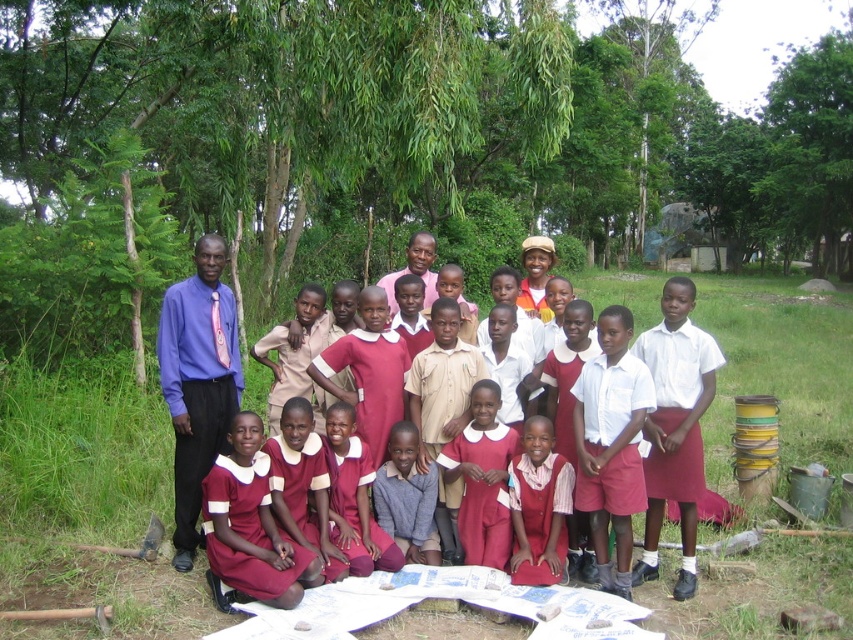
Between maroon dress at center and pink fabric shirt at center, which one has less height?

With less height is maroon dress at center.

Between maroon dress at center and pink fabric shirt at center, which one is positioned lower?

Positioned lower is maroon dress at center.

Is point (273, 406) behind point (412, 273)?

No, it is in front of (412, 273).

Locate an element on the screen. maroon dress at center is located at coordinates (334, 340).

Does point (641, 342) come behind point (177, 305)?

No, it is in front of (177, 305).

Is maroon dress at center taller than purple smooth shirt at center?

In fact, maroon dress at center may be shorter than purple smooth shirt at center.

Find the location of a particular element. maroon dress at center is located at coordinates (334, 340).

Where is `maroon dress at center`? maroon dress at center is located at coordinates (334, 340).

Who is higher up, white cotton shirt at center or pink fabric shirt at center?

pink fabric shirt at center is higher up.

Which is in front, point (712, 392) or point (416, 273)?

Positioned in front is point (712, 392).

The height and width of the screenshot is (640, 853). In order to click on white cotton shirt at center in this screenshot , I will do `click(675, 428)`.